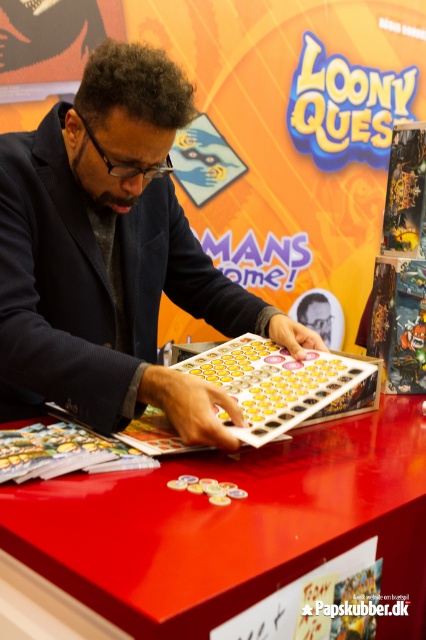
Is matte black suit at center thinner than shiny plastic board game at center?

No, matte black suit at center is not thinner than shiny plastic board game at center.

Can you confirm if matte black suit at center is wider than shiny plastic board game at center?

Correct, the width of matte black suit at center exceeds that of shiny plastic board game at center.

Between point (37, 392) and point (161, 445), which one is positioned in front?

Point (161, 445)

Identify the location of matte black suit at center. This screenshot has height=640, width=426. (112, 257).